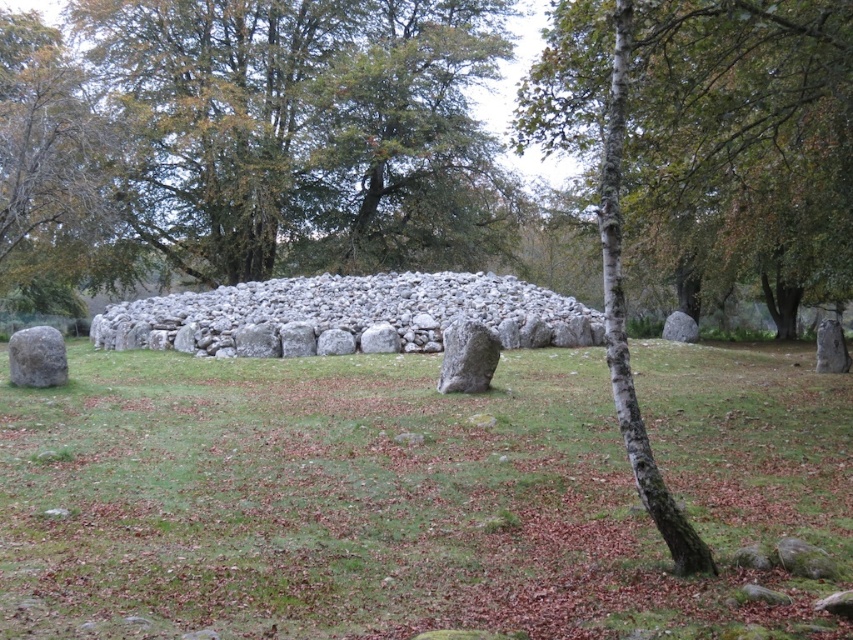
Question: Does green grass at center have a lesser width compared to bark textured tree at center?

Choices:
 (A) yes
 (B) no

Answer: (B)

Question: Which point appears farthest from the camera in this image?

Choices:
 (A) (474, 364)
 (B) (833, 225)
 (C) (15, 332)

Answer: (B)

Question: Estimate the real-world distances between objects in this image. Which object is farther from the bark textured tree at center?

Choices:
 (A) green grass at center
 (B) gray smooth boulder at left
 (C) gray rough boulder at center

Answer: (B)

Question: Which point is farther from the camera taking this photo?

Choices:
 (A) click(x=16, y=344)
 (B) click(x=741, y=131)
 (C) click(x=363, y=600)
 (D) click(x=483, y=340)

Answer: (A)

Question: Is green grass at center below bark textured tree at center?

Choices:
 (A) no
 (B) yes

Answer: (B)

Question: Is bark textured tree at center closer to camera compared to gray rough boulder at center?

Choices:
 (A) yes
 (B) no

Answer: (A)